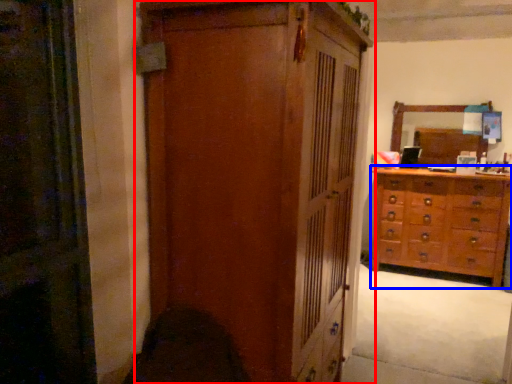
Question: Which point is closer to the camera, cupboard (highlighted by a red box) or chest of drawers (highlighted by a blue box)?

Choices:
 (A) cupboard
 (B) chest of drawers

Answer: (A)